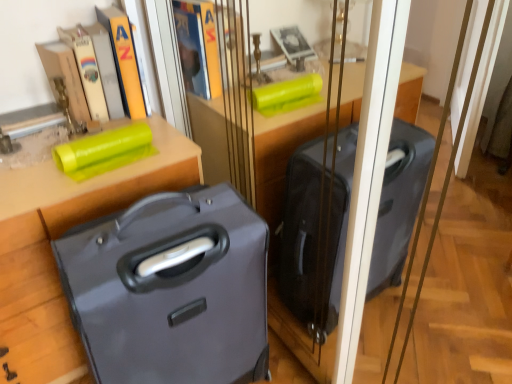
Identify the location of matte gray suitcase at lower left. This screenshot has width=512, height=384. (x=170, y=290).

What do you see at coordinates (170, 290) in the screenshot? I see `matte gray suitcase at lower left` at bounding box center [170, 290].

The image size is (512, 384). In order to click on matte black suitcase at left in this screenshot , I will do point(59,236).

This screenshot has width=512, height=384. What do you see at coordinates (59, 236) in the screenshot? I see `matte black suitcase at left` at bounding box center [59, 236].

Identify the location of matte gray suitcase at lower left. (170, 290).

Looking at this image, considering the positions of objects matte black suitcase at left and matte gray suitcase at lower left in the image provided, who is more to the right, matte black suitcase at left or matte gray suitcase at lower left?

From the viewer's perspective, matte gray suitcase at lower left appears more on the right side.

Which object is more forward, matte black suitcase at left or matte gray suitcase at lower left?

matte gray suitcase at lower left.

Is point (50, 274) closer to camera compared to point (190, 322)?

That is False.

From the image's perspective, is matte black suitcase at left located above or below matte gray suitcase at lower left?

Based on their image positions, matte black suitcase at left is located above matte gray suitcase at lower left.

From a real-world perspective, is matte black suitcase at left on matte gray suitcase at lower left?

No, from a real-world perspective, matte black suitcase at left is not on top of matte gray suitcase at lower left.

Which of these two, matte black suitcase at left or matte gray suitcase at lower left, is wider?

matte black suitcase at left is wider.

Who is shorter, matte black suitcase at left or matte gray suitcase at lower left?

With less height is matte black suitcase at left.

Considering the relative sizes of matte black suitcase at left and matte gray suitcase at lower left in the image provided, is matte black suitcase at left bigger than matte gray suitcase at lower left?

Yes, matte black suitcase at left is bigger than matte gray suitcase at lower left.

Is matte black suitcase at left inside or outside of matte gray suitcase at lower left?

matte black suitcase at left is spatially situated outside matte gray suitcase at lower left.

Is matte black suitcase at left far away from matte gray suitcase at lower left?

They are positioned close to each other.

Is matte black suitcase at left looking in the opposite direction of matte gray suitcase at lower left?

No, matte black suitcase at left is not facing away from matte gray suitcase at lower left.

Locate an element on the screen. suitcase lying in front of the matte black suitcase at left is located at coordinates (170, 290).

Considering the positions of objects matte gray suitcase at lower left and matte black suitcase at left in the image provided, who is more to the left, matte gray suitcase at lower left or matte black suitcase at left?

Positioned to the left is matte black suitcase at left.

Between matte gray suitcase at lower left and matte black suitcase at left, which one is positioned behind?

matte black suitcase at left is further away from the camera.

Is point (97, 285) more distant than point (57, 220)?

No, it is in front of (57, 220).

From the image's perspective, does matte gray suitcase at lower left appear lower than matte black suitcase at left?

Yes, from the image's perspective, matte gray suitcase at lower left is beneath matte black suitcase at left.

From a real-world perspective, is matte gray suitcase at lower left located beneath matte black suitcase at left?

Incorrect, from a real-world perspective, matte gray suitcase at lower left is higher than matte black suitcase at left.

Is matte gray suitcase at lower left wider or thinner than matte black suitcase at left?

matte gray suitcase at lower left is thinner than matte black suitcase at left.

Is matte gray suitcase at lower left taller or shorter than matte black suitcase at left?

In the image, matte gray suitcase at lower left appears to be taller than matte black suitcase at left.

Considering the relative sizes of matte gray suitcase at lower left and matte black suitcase at left in the image provided, is matte gray suitcase at lower left bigger than matte black suitcase at left?

Incorrect, matte gray suitcase at lower left is not larger than matte black suitcase at left.

Is matte gray suitcase at lower left inside the boundaries of matte black suitcase at left, or outside?

matte gray suitcase at lower left is not inside matte black suitcase at left, it's outside.

Is matte gray suitcase at lower left next to matte black suitcase at left and touching it?

matte gray suitcase at lower left and matte black suitcase at left are clearly separated.

Could you tell me if matte gray suitcase at lower left is facing matte black suitcase at left?

No, matte gray suitcase at lower left does not turn towards matte black suitcase at left.

Where is `furniture above the matte gray suitcase at lower left (from the image's perspective)`? furniture above the matte gray suitcase at lower left (from the image's perspective) is located at coordinates (59, 236).

At what (x,y) coordinates should I click in order to perform the action: click on suitcase in front of the matte black suitcase at left. Please return your answer as a coordinate pair (x, y). Looking at the image, I should click on (170, 290).

Locate an element on the screen. suitcase above the matte black suitcase at left (from a real-world perspective) is located at coordinates (170, 290).